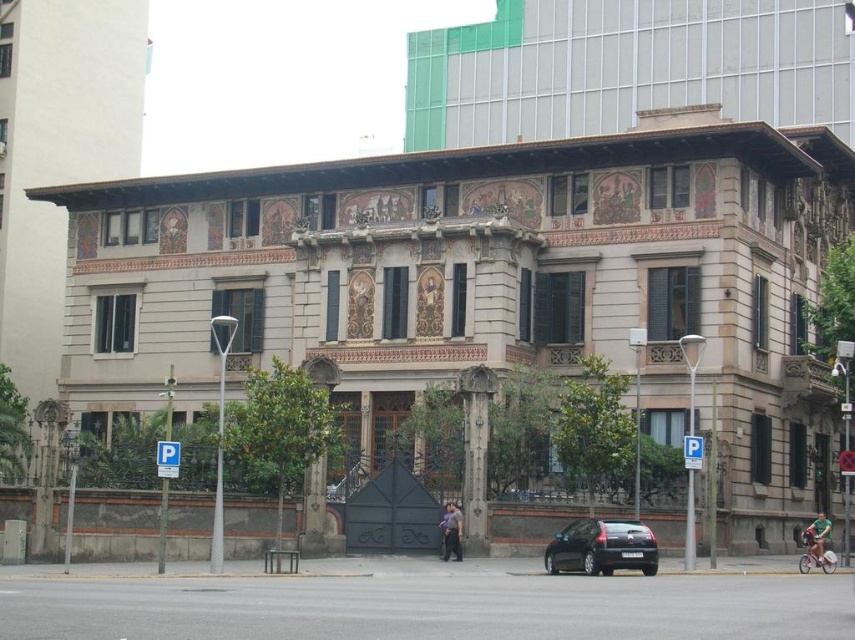
Can you confirm if shiny black car at lower center is bigger than dark gray stone pillar at center?

No.

Who is more forward, (631,547) or (472,408)?

Point (631,547)

Is point (634, 563) positioned before point (484, 493)?

Yes, point (634, 563) is in front of point (484, 493).

The width and height of the screenshot is (855, 640). In order to click on shiny black car at lower center in this screenshot , I will do `click(600, 547)`.